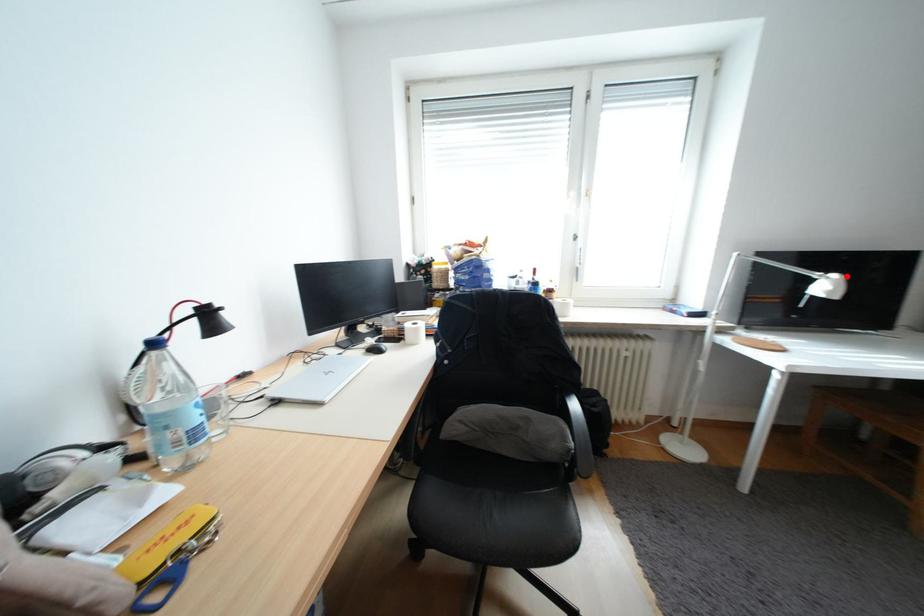
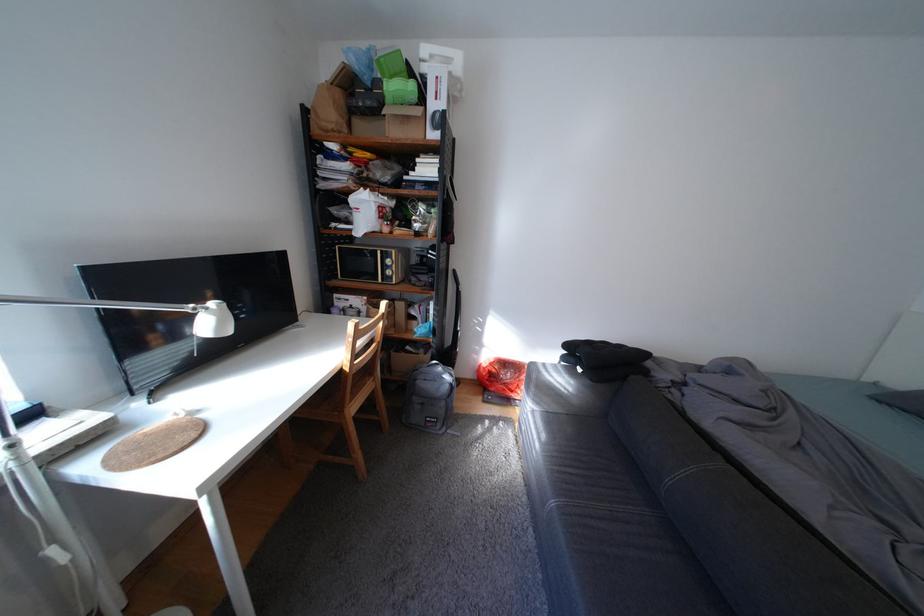
Where in the second image is the point corresponding to the highlighted location from the first image?

(225, 305)